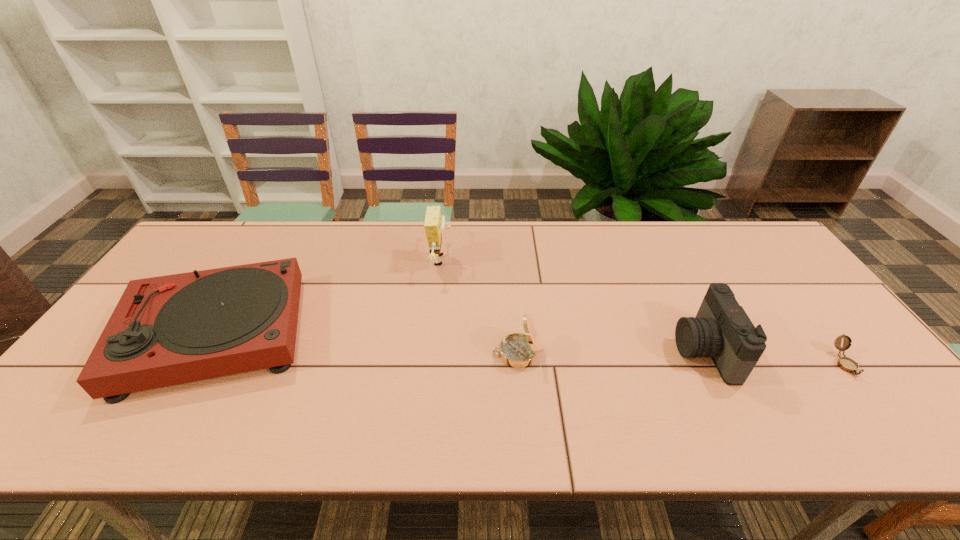
At what (x,y) coordinates should I click in order to perform the action: click on the fourth object from right to left. Please return your answer as a coordinate pair (x, y). This screenshot has width=960, height=540. Looking at the image, I should click on (434, 224).

Locate an element on the screen. The image size is (960, 540). the tallest object is located at coordinates (434, 224).

Where is `camera`? The height and width of the screenshot is (540, 960). camera is located at coordinates 722,330.

Locate an element on the screen. This screenshot has width=960, height=540. the second object from right to left is located at coordinates (722, 330).

Where is `the leftmost object`? This screenshot has height=540, width=960. the leftmost object is located at coordinates (167, 330).

At what (x,y) coordinates should I click in order to perform the action: click on the left compass. Please return your answer as a coordinate pair (x, y). This screenshot has height=540, width=960. Looking at the image, I should click on (518, 350).

In order to click on the taller compass in this screenshot , I will do `click(518, 350)`.

This screenshot has height=540, width=960. I want to click on the shorter compass, so click(x=847, y=364).

Locate an element on the screen. the shortest object is located at coordinates (847, 364).

Find the location of a particular element. Image resolution: width=960 pixels, height=540 pixels. vacant position located 0.310m on the face of the sponge is located at coordinates (551, 260).